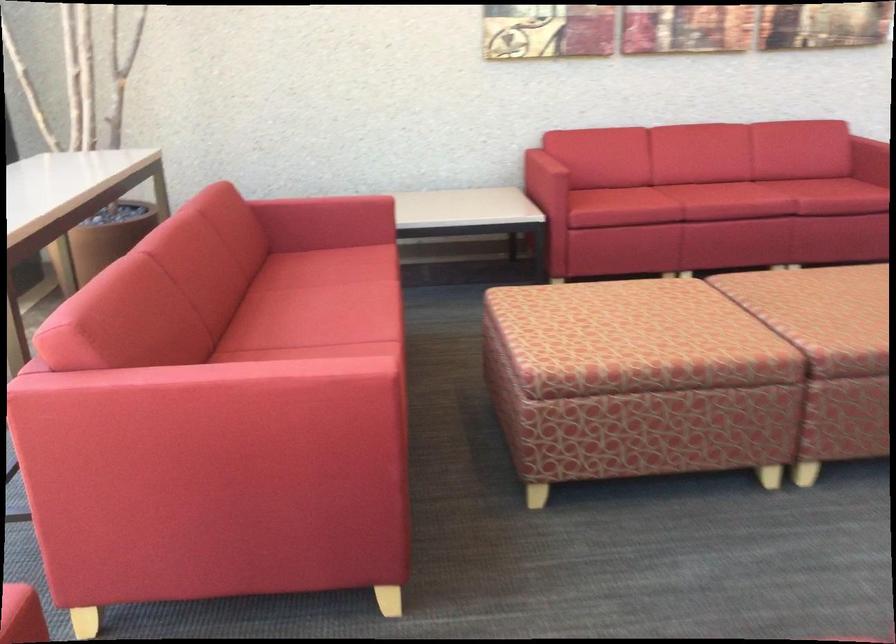
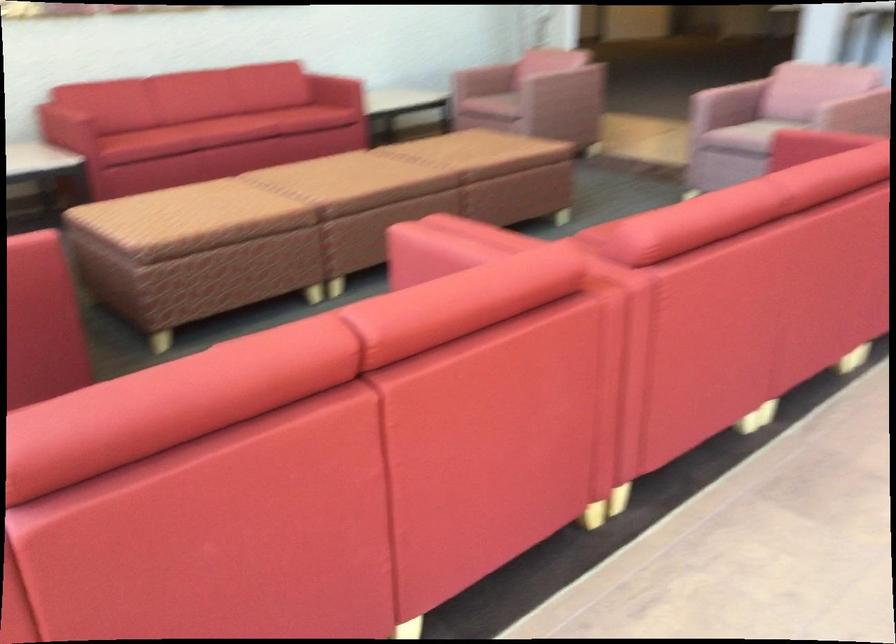
Locate, in the second image, the point that corresponds to point 725,201 in the first image.

(235, 129)